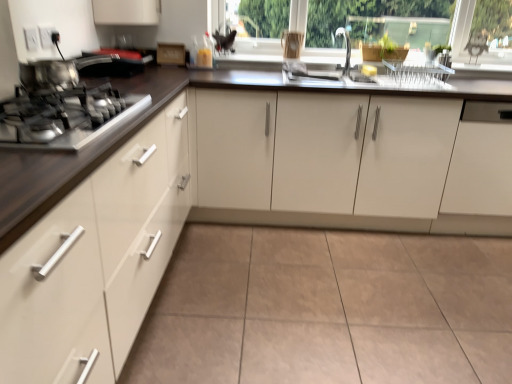
I want to click on white glossy cabinets at center, which is the 2th cabinetry from left to right, so click(x=351, y=164).

This screenshot has width=512, height=384. What do you see at coordinates (375, 30) in the screenshot? I see `transparent glass window frame at upper center` at bounding box center [375, 30].

You are a GUI agent. You are given a task and a screenshot of the screen. Output one action in this format:
    pyautogui.click(x=<x>, y=<y>)
    Task: Click on the white matte cabinet at right, which is counted as the third cabinetry, starting from the left
    The height and width of the screenshot is (384, 512).
    Given the screenshot: What is the action you would take?
    pyautogui.click(x=481, y=162)

This screenshot has width=512, height=384. Describe the element at coordinates (96, 260) in the screenshot. I see `matte white cabinet at left, placed as the third cabinetry when sorted from right to left` at that location.

Describe the element at coordinates (57, 72) in the screenshot. I see `metallic silver pot at left` at that location.

In order to click on metallic silver gas stove at left in this screenshot , I will do pyautogui.click(x=66, y=117).

Is point (484, 223) positioned before point (40, 75)?

No, (484, 223) is behind (40, 75).

In terms of height, does white glossy cabinets at center, which is counted as the second cabinetry, starting from the right, look taller or shorter compared to metallic silver pot at left?

In the image, white glossy cabinets at center, which is counted as the second cabinetry, starting from the right, appears to be taller than metallic silver pot at left.

Are white glossy cabinets at center, which is counted as the second cabinetry, starting from the right, and metallic silver pot at left located far from each other?

white glossy cabinets at center, which is counted as the second cabinetry, starting from the right, is far away from metallic silver pot at left.

Based on the photo, considering the sizes of white glossy cabinets at center, which is the 2th cabinetry from left to right, and metallic silver pot at left in the image, is white glossy cabinets at center, which is the 2th cabinetry from left to right, wider or thinner than metallic silver pot at left?

white glossy cabinets at center, which is the 2th cabinetry from left to right, is wider than metallic silver pot at left.

Is white matte cabinet at right, which is counted as the third cabinetry, starting from the left, completely or partially inside metallic silver pot at left?

No, white matte cabinet at right, which is counted as the third cabinetry, starting from the left, is not inside metallic silver pot at left.

Is metallic silver pot at left to the left of white matte cabinet at right, positioned as the 1th cabinetry in right-to-left order, from the viewer's perspective?

Yes.

Is there a large distance between metallic silver pot at left and white matte cabinet at right, which is counted as the third cabinetry, starting from the left?

That's right, there is a large distance between metallic silver pot at left and white matte cabinet at right, which is counted as the third cabinetry, starting from the left.

From the image's perspective, is metallic silver pot at left located above or below white matte cabinet at right, positioned as the 1th cabinetry in right-to-left order?

metallic silver pot at left is above white matte cabinet at right, positioned as the 1th cabinetry in right-to-left order.

Does point (73, 81) come behind point (97, 279)?

Yes, point (73, 81) is behind point (97, 279).

Is metallic silver pot at left outside of matte white cabinet at left, placed as the third cabinetry when sorted from right to left?

No, most part of metallic silver pot at left lies within matte white cabinet at left, placed as the third cabinetry when sorted from right to left.

Is metallic silver pot at left to the left of matte white cabinet at left, placed as the third cabinetry when sorted from right to left, from the viewer's perspective?

Yes.

Measure the distance between metallic silver pot at left and matte white cabinet at left, the 1th cabinetry from the left.

They are 26.49 inches apart.

Based on the photo, in terms of width, does matte white cabinet at left, placed as the third cabinetry when sorted from right to left, look wider or thinner when compared to white matte cabinet at right, positioned as the 1th cabinetry in right-to-left order?

Clearly, matte white cabinet at left, placed as the third cabinetry when sorted from right to left, has more width compared to white matte cabinet at right, positioned as the 1th cabinetry in right-to-left order.

Is matte white cabinet at left, the 1th cabinetry from the left, shorter than white matte cabinet at right, positioned as the 1th cabinetry in right-to-left order?

No.

From the image's perspective, is matte white cabinet at left, placed as the third cabinetry when sorted from right to left, under white matte cabinet at right, which is counted as the third cabinetry, starting from the left?

Yes.

Would you say white matte cabinet at right, positioned as the 1th cabinetry in right-to-left order, is part of matte white cabinet at left, the 1th cabinetry from the left,'s contents?

That's incorrect, white matte cabinet at right, positioned as the 1th cabinetry in right-to-left order, is not inside matte white cabinet at left, the 1th cabinetry from the left.

Considering the relative sizes of matte white cabinet at left, placed as the third cabinetry when sorted from right to left, and metallic silver gas stove at left in the image provided, is matte white cabinet at left, placed as the third cabinetry when sorted from right to left, smaller than metallic silver gas stove at left?

Actually, matte white cabinet at left, placed as the third cabinetry when sorted from right to left, might be larger than metallic silver gas stove at left.

Does matte white cabinet at left, placed as the third cabinetry when sorted from right to left, contain metallic silver gas stove at left?

Yes, metallic silver gas stove at left is a part of matte white cabinet at left, placed as the third cabinetry when sorted from right to left.

Is the depth of matte white cabinet at left, placed as the third cabinetry when sorted from right to left, less than that of metallic silver gas stove at left?

Yes, matte white cabinet at left, placed as the third cabinetry when sorted from right to left, is in front of metallic silver gas stove at left.

From the image's perspective, is matte white cabinet at left, the 1th cabinetry from the left, located beneath metallic silver gas stove at left?

Correct, matte white cabinet at left, the 1th cabinetry from the left, appears lower than metallic silver gas stove at left in the image.

I want to click on the 2nd cabinetry behind the metallic silver pot at left, starting your count from the anchor, so click(x=481, y=162).

In the scene shown: From a real-world perspective, who is located lower, white matte cabinet at right, positioned as the 1th cabinetry in right-to-left order, or metallic silver pot at left?

white matte cabinet at right, positioned as the 1th cabinetry in right-to-left order, from a real-world perspective.

Is white matte cabinet at right, which is counted as the third cabinetry, starting from the left, completely or partially outside of metallic silver pot at left?

white matte cabinet at right, which is counted as the third cabinetry, starting from the left, is positioned outside metallic silver pot at left.

In terms of width, does white matte cabinet at right, which is counted as the third cabinetry, starting from the left, look wider or thinner when compared to metallic silver pot at left?

Considering their sizes, white matte cabinet at right, which is counted as the third cabinetry, starting from the left, looks broader than metallic silver pot at left.

Is transparent glass window frame at upper center thinner than matte white cabinet at left, the 1th cabinetry from the left?

Yes, transparent glass window frame at upper center is thinner than matte white cabinet at left, the 1th cabinetry from the left.

Looking at this image, considering the relative sizes of transparent glass window frame at upper center and matte white cabinet at left, the 1th cabinetry from the left, in the image provided, is transparent glass window frame at upper center shorter than matte white cabinet at left, the 1th cabinetry from the left,?

Correct, transparent glass window frame at upper center is not as tall as matte white cabinet at left, the 1th cabinetry from the left.

Is transparent glass window frame at upper center placed right next to matte white cabinet at left, the 1th cabinetry from the left?

No, transparent glass window frame at upper center is not making contact with matte white cabinet at left, the 1th cabinetry from the left.

I want to click on window frame located above the matte white cabinet at left, the 1th cabinetry from the left (from a real-world perspective), so click(x=375, y=30).

This screenshot has height=384, width=512. Find the location of `the 1st cabinetry below the metallic silver pot at left (from the image's perspective)`. the 1st cabinetry below the metallic silver pot at left (from the image's perspective) is located at coordinates (351, 164).

This screenshot has height=384, width=512. There is a metallic silver pot at left. Find the location of `the 1st cabinetry below it (from a real-world perspective)`. the 1st cabinetry below it (from a real-world perspective) is located at coordinates (481, 162).

Which object lies further to the anchor point white glossy cabinets at center, which is counted as the second cabinetry, starting from the right, metallic silver pot at left or matte white cabinet at left, the 1th cabinetry from the left?

metallic silver pot at left is further to white glossy cabinets at center, which is counted as the second cabinetry, starting from the right.

Considering their positions, is metallic silver gas stove at left positioned closer to transparent glass window frame at upper center than matte white cabinet at left, placed as the third cabinetry when sorted from right to left?

The object closer to transparent glass window frame at upper center is metallic silver gas stove at left.

Considering their positions, is metallic silver gas stove at left positioned closer to metallic silver pot at left than white glossy cabinets at center, which is counted as the second cabinetry, starting from the right?

Based on the image, metallic silver gas stove at left appears to be nearer to metallic silver pot at left.

Estimate the real-world distances between objects in this image. Which object is closer to white glossy cabinets at center, which is the 2th cabinetry from left to right, white matte cabinet at right, which is counted as the third cabinetry, starting from the left, or transparent glass window frame at upper center?

white matte cabinet at right, which is counted as the third cabinetry, starting from the left, is closer to white glossy cabinets at center, which is the 2th cabinetry from left to right.

Looking at the image, which one is located further to matte white cabinet at left, the 1th cabinetry from the left, transparent glass window frame at upper center or white glossy cabinets at center, which is counted as the second cabinetry, starting from the right?

Among the two, transparent glass window frame at upper center is located further to matte white cabinet at left, the 1th cabinetry from the left.

Looking at the image, which one is located further to white matte cabinet at right, which is counted as the third cabinetry, starting from the left, white glossy cabinets at center, which is counted as the second cabinetry, starting from the right, or transparent glass window frame at upper center?

transparent glass window frame at upper center lies further to white matte cabinet at right, which is counted as the third cabinetry, starting from the left, than the other object.

When comparing their distances from white matte cabinet at right, which is counted as the third cabinetry, starting from the left, does metallic silver gas stove at left or matte white cabinet at left, the 1th cabinetry from the left, seem closer?

matte white cabinet at left, the 1th cabinetry from the left, is closer to white matte cabinet at right, which is counted as the third cabinetry, starting from the left.

When comparing their distances from white glossy cabinets at center, which is counted as the second cabinetry, starting from the right, does matte white cabinet at left, placed as the third cabinetry when sorted from right to left, or metallic silver gas stove at left seem further?

metallic silver gas stove at left lies further to white glossy cabinets at center, which is counted as the second cabinetry, starting from the right, than the other object.

Find the location of a particular element. Image resolution: width=512 pixels, height=384 pixels. window frame between metallic silver pot at left and white matte cabinet at right, which is counted as the third cabinetry, starting from the left, in the horizontal direction is located at coordinates (375, 30).

Where is `window frame between metallic silver gas stove at left and white matte cabinet at right, which is counted as the third cabinetry, starting from the left, from left to right`? The height and width of the screenshot is (384, 512). window frame between metallic silver gas stove at left and white matte cabinet at right, which is counted as the third cabinetry, starting from the left, from left to right is located at coordinates (375, 30).

Image resolution: width=512 pixels, height=384 pixels. What are the coordinates of `gas stove between metallic silver pot at left and white glossy cabinets at center, which is the 2th cabinetry from left to right, from left to right` in the screenshot? It's located at (66, 117).

Identify the location of gas stove between matte white cabinet at left, the 1th cabinetry from the left, and metallic silver pot at left in the front-back direction. The image size is (512, 384). coord(66,117).